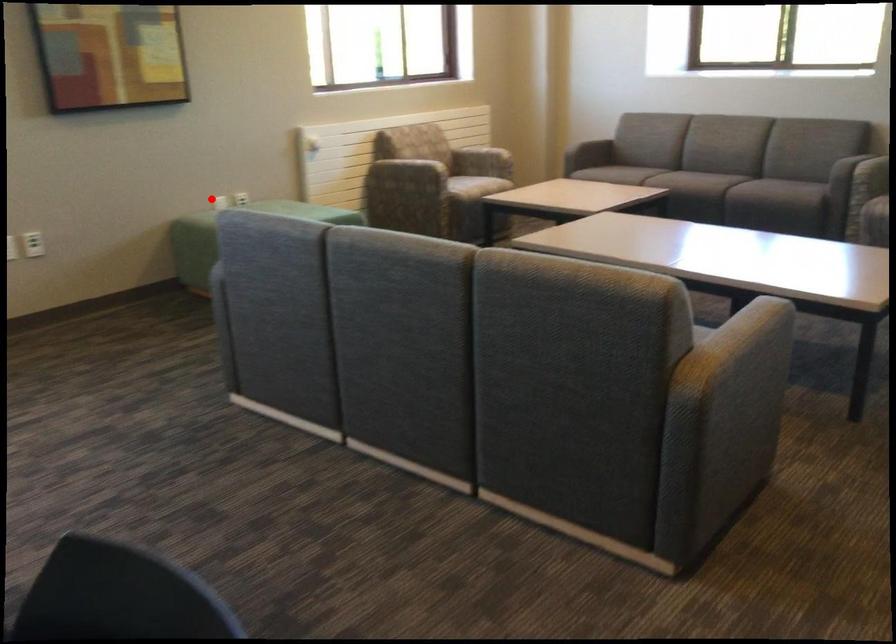
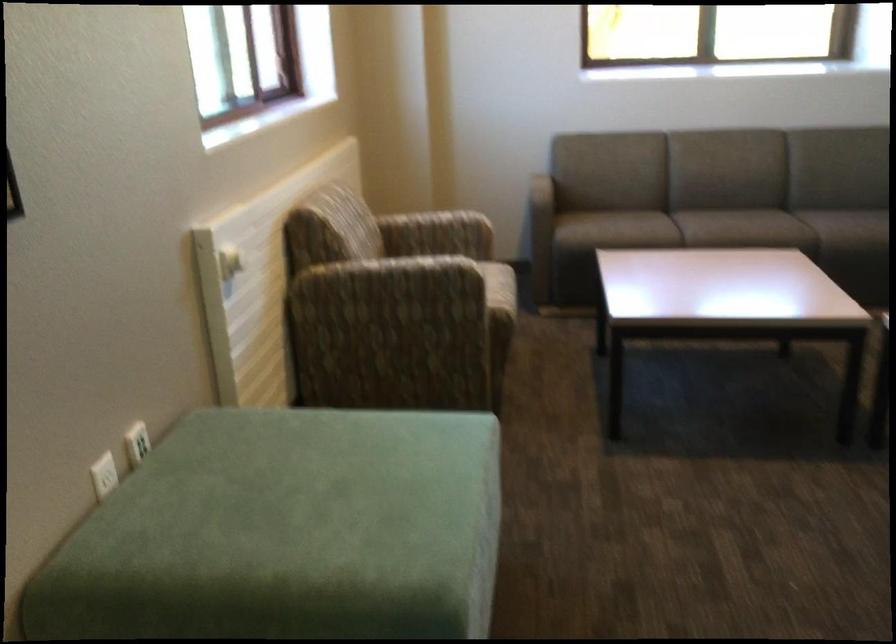
Find the pixel in the second image that matches the highlighted location in the first image.

(104, 475)